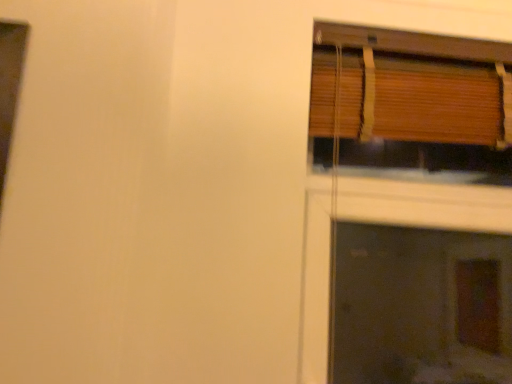
Find the location of a particular element. The image size is (512, 384). wooden blinds at upper right is located at coordinates (408, 209).

This screenshot has width=512, height=384. What do you see at coordinates (408, 209) in the screenshot? I see `wooden blinds at upper right` at bounding box center [408, 209].

Measure the distance between point (458,50) and camera.

Point (458,50) and camera are 3.87 feet apart.

This screenshot has width=512, height=384. Describe the element at coordinates (411, 99) in the screenshot. I see `wooden blinds at upper right` at that location.

This screenshot has height=384, width=512. Identify the location of wooden blinds at upper right. (411, 99).

You are a GUI agent. You are given a task and a screenshot of the screen. Output one action in this format:
    pyautogui.click(x=<x>, y=<y>)
    Task: Click on the wooden blinds at upper right
    
    Given the screenshot: What is the action you would take?
    pyautogui.click(x=408, y=209)

Which object is positioned more to the right, wooden blinds at upper right or wooden blinds at upper right?

wooden blinds at upper right is more to the right.

Considering their positions, is wooden blinds at upper right located in front of or behind wooden blinds at upper right?

In the image, wooden blinds at upper right appears behind wooden blinds at upper right.

Is point (441, 338) farther from viewer compared to point (369, 106)?

Yes.

From the image's perspective, is wooden blinds at upper right over wooden blinds at upper right?

No, from the image's perspective, wooden blinds at upper right is not over wooden blinds at upper right.

From a real-world perspective, is wooden blinds at upper right below wooden blinds at upper right?

Yes, from a real-world perspective, wooden blinds at upper right is under wooden blinds at upper right.

Can you confirm if wooden blinds at upper right is wider than wooden blinds at upper right?

Yes, wooden blinds at upper right is wider than wooden blinds at upper right.

Who is taller, wooden blinds at upper right or wooden blinds at upper right?

wooden blinds at upper right.

Which of these two, wooden blinds at upper right or wooden blinds at upper right, is smaller?

Smaller between the two is wooden blinds at upper right.

Is wooden blinds at upper right positioned beyond the bounds of wooden blinds at upper right?

Indeed, wooden blinds at upper right is completely outside wooden blinds at upper right.

Is wooden blinds at upper right in contact with wooden blinds at upper right?

No, wooden blinds at upper right is not touching wooden blinds at upper right.

Is wooden blinds at upper right facing towards wooden blinds at upper right?

Yes, wooden blinds at upper right is turned towards wooden blinds at upper right.

Locate an element on the screen. window in front of the wooden blinds at upper right is located at coordinates (411, 99).

Which object is positioned more to the right, wooden blinds at upper right or wooden blinds at upper right?

wooden blinds at upper right is more to the right.

Considering their positions, is wooden blinds at upper right located in front of or behind wooden blinds at upper right?

Visually, wooden blinds at upper right is located in front of wooden blinds at upper right.

Which is behind, point (357, 29) or point (352, 371)?

The point (352, 371) is farther.

From the image's perspective, which is above, wooden blinds at upper right or wooden blinds at upper right?

From the image's view, wooden blinds at upper right is above.

Looking at this image, from a real-world perspective, is wooden blinds at upper right positioned under wooden blinds at upper right based on gravity?

No.

Considering the relative sizes of wooden blinds at upper right and wooden blinds at upper right in the image provided, is wooden blinds at upper right thinner than wooden blinds at upper right?

Yes, wooden blinds at upper right is thinner than wooden blinds at upper right.

From their relative heights in the image, would you say wooden blinds at upper right is taller or shorter than wooden blinds at upper right?

In the image, wooden blinds at upper right appears to be shorter than wooden blinds at upper right.

Considering the sizes of wooden blinds at upper right and wooden blinds at upper right in the image, is wooden blinds at upper right bigger or smaller than wooden blinds at upper right?

In the image, wooden blinds at upper right appears to be smaller than wooden blinds at upper right.

Is wooden blinds at upper right outside of wooden blinds at upper right?

Indeed, wooden blinds at upper right is completely outside wooden blinds at upper right.

Is wooden blinds at upper right with wooden blinds at upper right?

No, wooden blinds at upper right is not next to wooden blinds at upper right.

In the scene shown: Is wooden blinds at upper right facing away from wooden blinds at upper right?

Yes, wooden blinds at upper right is positioned with its back facing wooden blinds at upper right.

Identify the location of window above the wooden blinds at upper right (from a real-world perspective). (411, 99).

Identify the location of window above the wooden blinds at upper right (from the image's perspective). (411, 99).

Locate an element on the screen. The width and height of the screenshot is (512, 384). window on the left of wooden blinds at upper right is located at coordinates (411, 99).